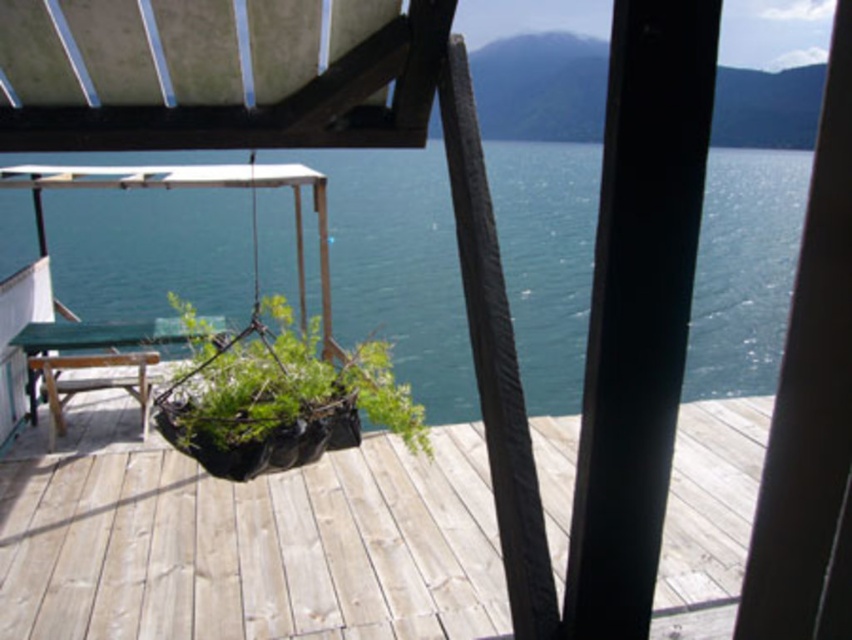
You are standing on the wooden deck and want to take a photo of the wooden at center and the blue water at center. Which object will appear larger in the photo?

The wooden at center will appear larger in the photo because it is closer to the viewer than the blue water at center.

You are standing on the wooden deck and see the blue water at center and the black fabric plant at center. Which object is positioned to the right of the other?

The blue water at center is to the right of the black fabric plant at center.

You are standing on the wooden deck and want to reach the point marked at coordinates point (695, 412). If your maximum walking distance is 20 feet, can you comfortably walk to that point without getting tired?

The distance between you and point (695, 412) is 20.80 feet, which is slightly longer than your 20 feet limit. You might get tired walking the entire distance.